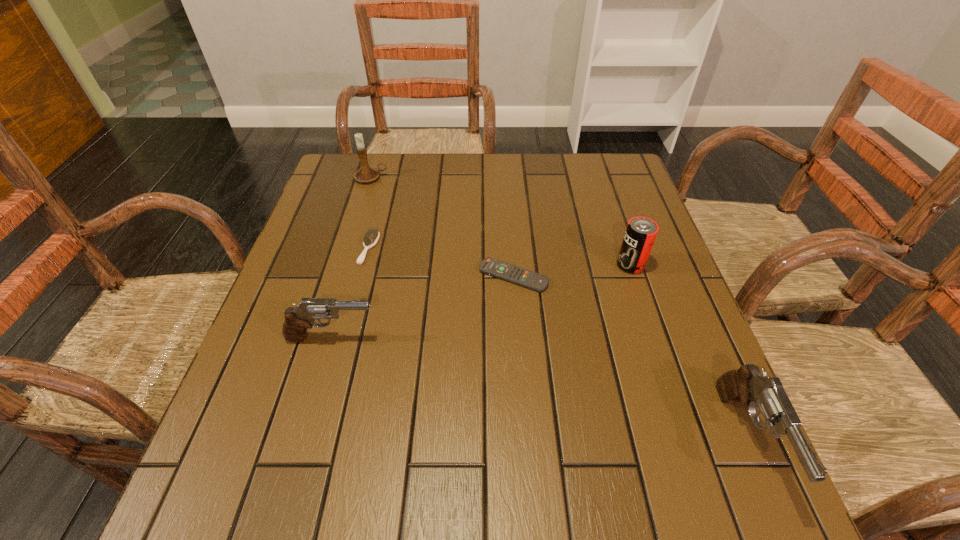
Locate an element on the screen. empty space between the shorter pistol and the shortest object is located at coordinates point(422,307).

The width and height of the screenshot is (960, 540). Find the location of `vacant space that is in between the nearest object and the fifth tallest object`. vacant space that is in between the nearest object and the fifth tallest object is located at coordinates (558, 343).

The image size is (960, 540). Identify the location of vacant space that's between the nearest object and the remote control. (630, 357).

The height and width of the screenshot is (540, 960). In order to click on vacant area that lies between the farthest object and the remote control in this screenshot , I will do `click(442, 227)`.

Where is `vacant area between the fifth tallest object and the candle holder`? vacant area between the fifth tallest object and the candle holder is located at coordinates (370, 213).

Identify the location of empty space between the fourth object from left to right and the fifth farthest object. (422, 307).

Identify the location of vacant space in between the scrubbing brush and the fifth farthest object. (350, 293).

I want to click on vacant area that lies between the farther pistol and the second shortest object, so click(x=350, y=293).

Where is `free spot between the scrubbing brush and the left pistol`? free spot between the scrubbing brush and the left pistol is located at coordinates (350, 293).

Locate an element on the screen. Image resolution: width=960 pixels, height=540 pixels. free space between the fifth tallest object and the rightmost object is located at coordinates (558, 343).